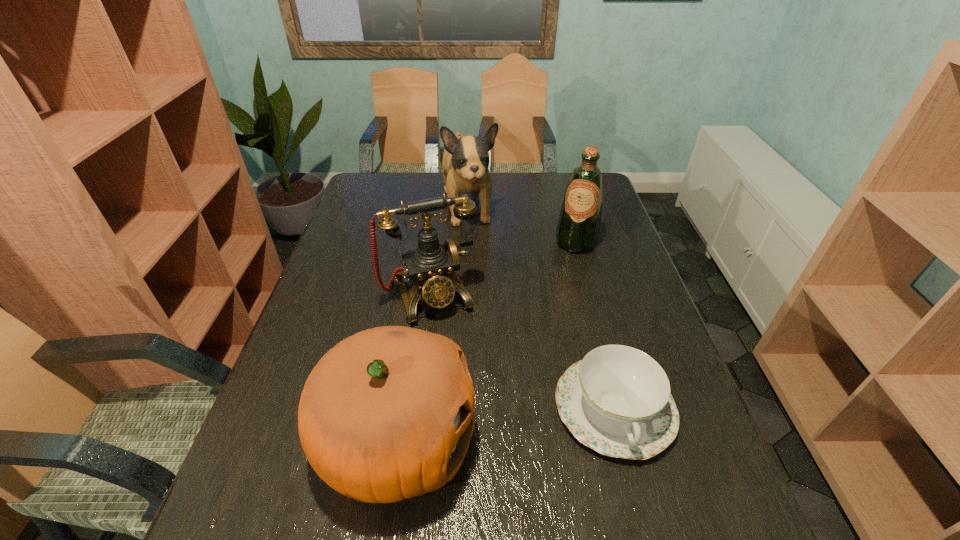
You are a GUI agent. You are given a task and a screenshot of the screen. Output one action in this format:
    pyautogui.click(x=<x>, y=<y>)
    Task: Click on the vacant area between the olive oil and the puppy
    
    Given the screenshot: What is the action you would take?
    pyautogui.click(x=522, y=225)

Locate an element on the screen. This screenshot has width=960, height=540. free spot between the shortest object and the telephone is located at coordinates (522, 352).

The width and height of the screenshot is (960, 540). Find the location of `empty space between the olive oil and the chinaware`. empty space between the olive oil and the chinaware is located at coordinates point(595,325).

I want to click on free space between the chinaware and the third nearest object, so click(522, 352).

This screenshot has width=960, height=540. I want to click on free space between the chinaware and the third farthest object, so [x=522, y=352].

This screenshot has width=960, height=540. In order to click on unoccupied area between the puppy and the olive oil in this screenshot , I will do `click(522, 225)`.

The height and width of the screenshot is (540, 960). Identify the location of unoccupied position between the olive oil and the puppy. (522, 225).

Locate an element on the screen. free space between the third farthest object and the chinaware is located at coordinates coord(522,352).

Identify which object is the fourth closest to the telephone. Please provide its 2D coordinates. Your answer should be formatted as a tuple, i.e. [(x, y)], where the tuple contains the x and y coordinates of a point satisfying the conditions above.

[(578, 227)]

Select which object is the closest to the pumpkin. Please provide its 2D coordinates. Your answer should be formatted as a tuple, i.e. [(x, y)], where the tuple contains the x and y coordinates of a point satisfying the conditions above.

[(433, 267)]